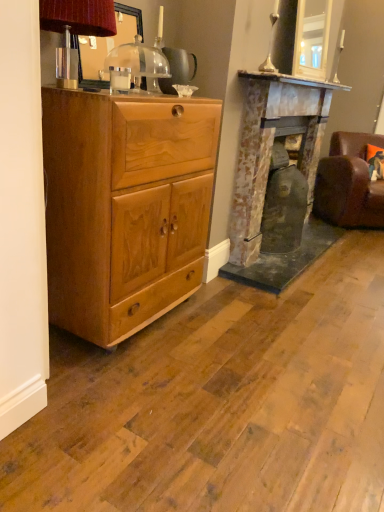
Question: Would you say brown leather swivel chair at right contains light brown wood chest of drawers at left?

Choices:
 (A) no
 (B) yes

Answer: (A)

Question: Are brown leather swivel chair at right and light brown wood chest of drawers at left making contact?

Choices:
 (A) yes
 (B) no

Answer: (B)

Question: Is the depth of brown leather swivel chair at right less than that of light brown wood chest of drawers at left?

Choices:
 (A) yes
 (B) no

Answer: (B)

Question: Can you confirm if brown leather swivel chair at right is thinner than light brown wood chest of drawers at left?

Choices:
 (A) no
 (B) yes

Answer: (A)

Question: Can you confirm if brown leather swivel chair at right is wider than light brown wood chest of drawers at left?

Choices:
 (A) no
 (B) yes

Answer: (B)

Question: In the image, is rustic stone fireplace at center positioned in front of or behind light brown wood chest of drawers at left?

Choices:
 (A) front
 (B) behind

Answer: (B)

Question: Is point (230, 257) positioned closer to the camera than point (82, 113)?

Choices:
 (A) closer
 (B) farther

Answer: (B)

Question: Visually, is rustic stone fireplace at center positioned to the left or to the right of light brown wood chest of drawers at left?

Choices:
 (A) left
 (B) right

Answer: (B)

Question: Is rustic stone fireplace at center situated inside light brown wood chest of drawers at left or outside?

Choices:
 (A) inside
 (B) outside

Answer: (B)

Question: From a real-world perspective, is brown leather swivel chair at right positioned above or below light brown wood chest of drawers at left?

Choices:
 (A) above
 (B) below

Answer: (B)

Question: Based on their sizes in the image, would you say brown leather swivel chair at right is bigger or smaller than light brown wood chest of drawers at left?

Choices:
 (A) small
 (B) big

Answer: (B)

Question: From the image's perspective, is brown leather swivel chair at right positioned above or below light brown wood chest of drawers at left?

Choices:
 (A) above
 (B) below

Answer: (A)

Question: Considering the positions of brown leather swivel chair at right and light brown wood chest of drawers at left in the image, is brown leather swivel chair at right wider or thinner than light brown wood chest of drawers at left?

Choices:
 (A) wide
 (B) thin

Answer: (A)

Question: Relative to matte brown lampshade at upper left, is brown leather swivel chair at right in front or behind?

Choices:
 (A) front
 (B) behind

Answer: (B)

Question: Visually, is brown leather swivel chair at right positioned to the left or to the right of matte brown lampshade at upper left?

Choices:
 (A) left
 (B) right

Answer: (B)